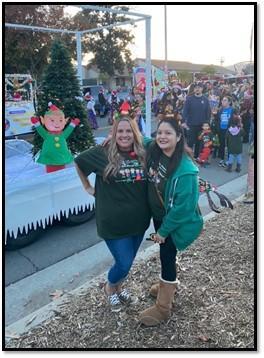
The height and width of the screenshot is (358, 264). What are the coordinates of `float frame` in the screenshot? It's located at (63, 29), (123, 26), (150, 68), (77, 72), (115, 6).